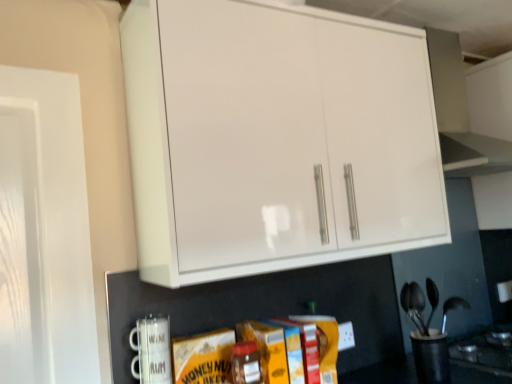
Question: Does black plastic utensil holder at lower right, the second appliance when ordered from front to back, lie in front of white glossy cabinet at upper center?

Choices:
 (A) yes
 (B) no

Answer: (B)

Question: Is the position of black plastic utensil holder at lower right, which appears as the 2th appliance when viewed from the left, more distant than that of white glossy cabinet at upper center?

Choices:
 (A) no
 (B) yes

Answer: (B)

Question: Can you confirm if black plastic utensil holder at lower right, acting as the 2th appliance starting from the top, is positioned to the left of white glossy cabinet at upper center?

Choices:
 (A) yes
 (B) no

Answer: (B)

Question: From the image's perspective, is black plastic utensil holder at lower right, the first appliance in the back-to-front sequence, on top of white glossy cabinet at upper center?

Choices:
 (A) no
 (B) yes

Answer: (A)

Question: From a real-world perspective, does black plastic utensil holder at lower right, which is the first appliance in bottom-to-top order, sit lower than white glossy cabinet at upper center?

Choices:
 (A) no
 (B) yes

Answer: (B)

Question: Do you think matte glass jar at center is within white ceramic mug at lower left, positioned as the first appliance in left-to-right order, or outside of it?

Choices:
 (A) outside
 (B) inside

Answer: (A)

Question: Based on their sizes in the image, would you say matte glass jar at center is bigger or smaller than white ceramic mug at lower left, marked as the first appliance in a top-to-bottom arrangement?

Choices:
 (A) big
 (B) small

Answer: (A)

Question: From their relative heights in the image, would you say matte glass jar at center is taller or shorter than white ceramic mug at lower left, the second appliance viewed from the back?

Choices:
 (A) short
 (B) tall

Answer: (B)

Question: Looking at their shapes, would you say matte glass jar at center is wider or thinner than white ceramic mug at lower left, the second appliance viewed from the back?

Choices:
 (A) thin
 (B) wide

Answer: (B)

Question: From a real-world perspective, is white ceramic mug at lower left, the first appliance from the front, physically located above or below white glossy cabinet at upper center?

Choices:
 (A) above
 (B) below

Answer: (B)

Question: Would you say white ceramic mug at lower left, the second appliance viewed from the back, is to the left or to the right of white glossy cabinet at upper center in the picture?

Choices:
 (A) right
 (B) left

Answer: (B)

Question: Considering their positions, is white ceramic mug at lower left, marked as the first appliance in a top-to-bottom arrangement, located in front of or behind white glossy cabinet at upper center?

Choices:
 (A) front
 (B) behind

Answer: (B)

Question: Considering the positions of point (147, 329) and point (177, 283), is point (147, 329) closer or farther from the camera than point (177, 283)?

Choices:
 (A) closer
 (B) farther

Answer: (B)

Question: Is point (431, 370) positioned closer to the camera than point (246, 127)?

Choices:
 (A) farther
 (B) closer

Answer: (A)

Question: From the image's perspective, is black plastic utensil holder at lower right, which appears as the 2th appliance when viewed from the left, above or below white glossy cabinet at upper center?

Choices:
 (A) above
 (B) below

Answer: (B)